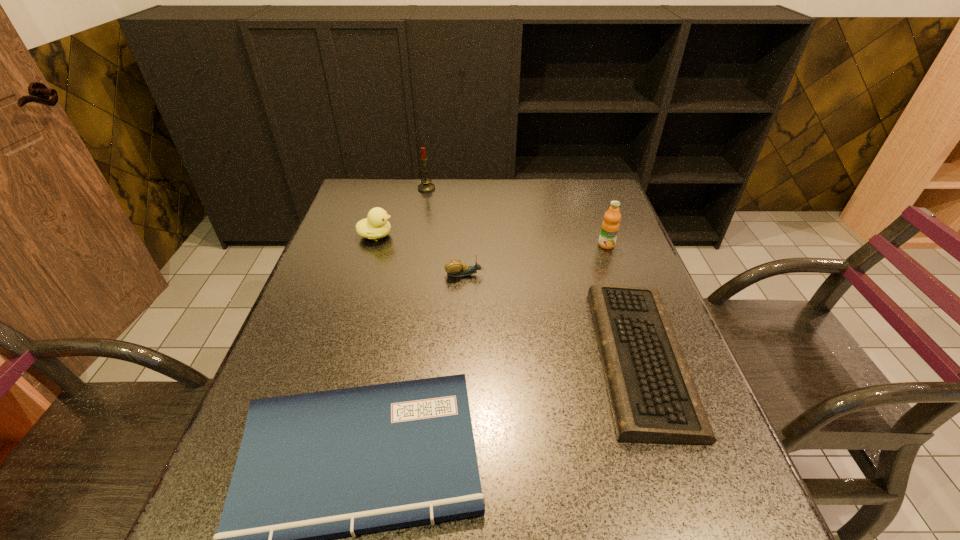
Identify the location of the farthest object. (426, 186).

Identify the location of orange juice. (x=610, y=225).

You are a GUI agent. You are given a task and a screenshot of the screen. Output one action in this format:
    pyautogui.click(x=<x>, y=<y>)
    Task: Click on the duckling
    The width and height of the screenshot is (960, 540).
    Given the screenshot: What is the action you would take?
    pyautogui.click(x=376, y=226)

Where is `the fourth farthest object`? The height and width of the screenshot is (540, 960). the fourth farthest object is located at coordinates (455, 268).

The width and height of the screenshot is (960, 540). Find the location of `the third shortest object`. the third shortest object is located at coordinates (455, 268).

Where is `computer keyboard`? This screenshot has width=960, height=540. computer keyboard is located at coordinates (653, 397).

Find the location of a particular element. The image size is (960, 540). free point located on the front of the candle is located at coordinates (422, 212).

You are a GUI agent. You are given a task and a screenshot of the screen. Output one action in this format:
    pyautogui.click(x=<x>, y=<y>)
    Task: Click on the free spot located 0.230m on the label of the orange juice
    Image resolution: width=960 pixels, height=540 pixels.
    Given the screenshot: What is the action you would take?
    pyautogui.click(x=629, y=308)

The width and height of the screenshot is (960, 540). I want to click on free space located 0.050m at the beak of the duckling, so coord(411,235).

Locate an element on the screen. blank area located 0.280m on the front-facing side of the escargot is located at coordinates point(590,274).